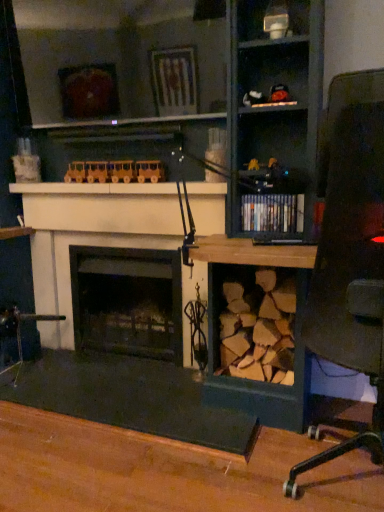
Question: Looking at their shapes, would you say white glossy vase at upper center is wider or thinner than wooden train at upper center, which is the second toy in right-to-left order?

Choices:
 (A) thin
 (B) wide

Answer: (B)

Question: In the image, is white glossy vase at upper center positioned in front of or behind wooden train at upper center, which is the second toy in right-to-left order?

Choices:
 (A) front
 (B) behind

Answer: (A)

Question: Which object is the closest to the matte black toy car at upper center, which is counted as the 1th toy, starting from the front?

Choices:
 (A) white matte fireplace at center, acting as the 2th fireplace starting from the back
 (B) black matte fireplace at center, which appears as the 2th fireplace when viewed from the front
 (C) wooden train at upper center, which appears as the second toy when viewed from the top
 (D) white glossy vase at upper center
 (E) wooden desk at center

Answer: (D)

Question: Which object is positioned farthest from the white matte fireplace at center, positioned as the 1th fireplace in front-to-back order?

Choices:
 (A) shiny black books at center
 (B) wooden desk at center
 (C) matte black toy car at upper center, which ranks as the 2th toy in back-to-front order
 (D) black matte fireplace at center, which appears as the 2th fireplace when viewed from the front
 (E) white glossy vase at upper center

Answer: (E)